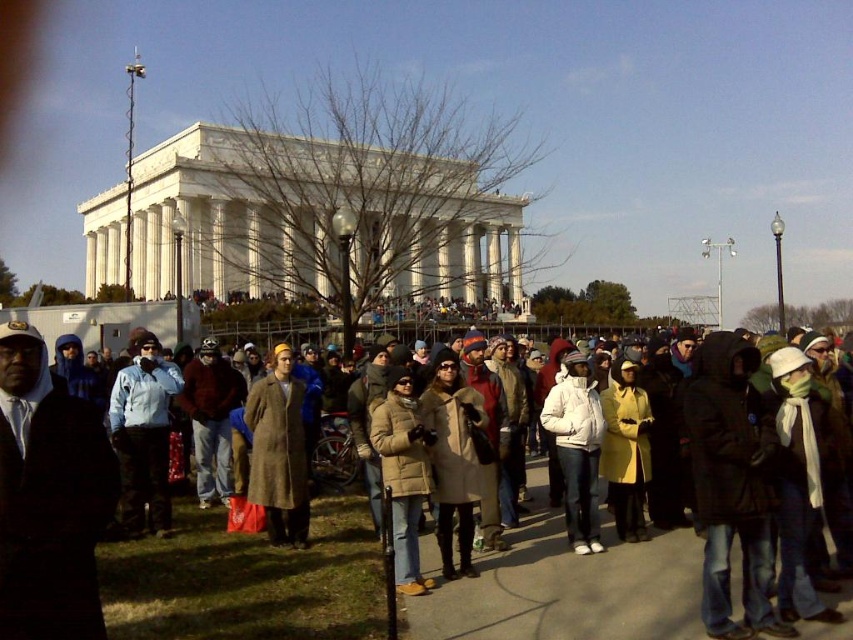
You are standing at the point labeled as point (567,588) in the image. What object are you currently standing on?

The point (567,588) is on the light brown coat at center, so you are standing on the light brown coat at center.

You are standing in the crowd at the Lincoln Memorial and notice two coats at the center. Which coat is positioned to the right when looking at the light brown coat at center and the brown wool coat at center?

The light brown coat at center is to the right of the brown wool coat at center.

You are standing in the crowd at the Lincoln Memorial and want to take a photo of both the point at coordinates point (x=251, y=416) and point (x=554, y=429). Which point will appear closer to the camera in your photo?

Point (x=251, y=416) is further to the viewer than point (x=554, y=429), so in the photo, point (x=251, y=416) will appear closer to the camera than point (x=554, y=429).